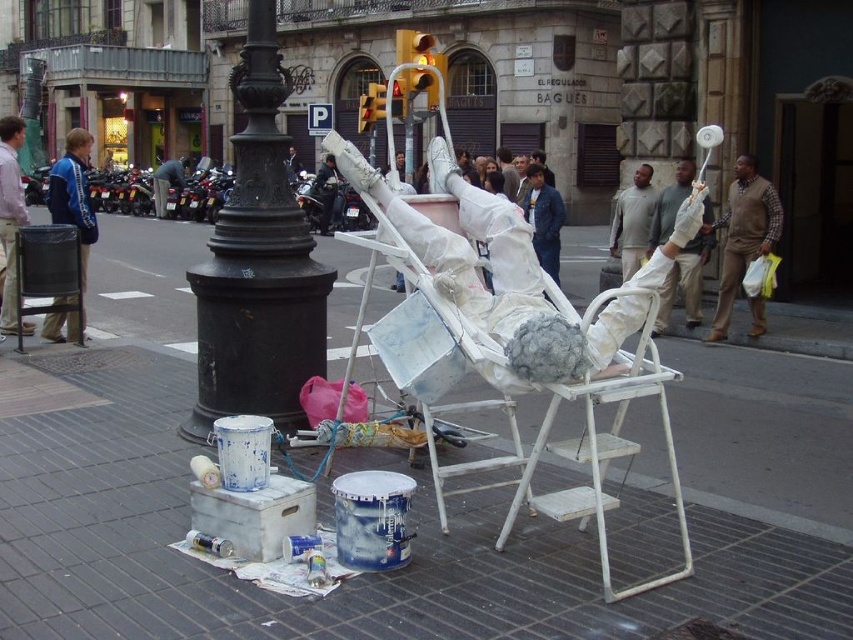
You are a photographer trying to capture both the blue striped jacket at left and the white fabric glove at upper center in a single shot. Which object should you focus on first if you want to ensure both are in frame without moving the camera?

You should focus on the blue striped jacket at left first since it is larger in size than the white fabric glove at upper center, making it easier to frame both objects in the shot.

You are a city planner reviewing the layout of this urban space. The city has a rule that all public art installations must be placed at least 0.5 meters away from any lamppost or traffic light to ensure safety and visibility. Given the coordinates of the white fabric figure at center, can you determine if it complies with this regulation?

The white fabric figure at center is located at coordinates (514, 273). Without knowing the exact positions of the lamppost and traffic lights, it is impossible to determine if the distance requirement is met. The city planner would need to compare the figure coordinates with those of the lamppost and traffic lights to ensure compliance.